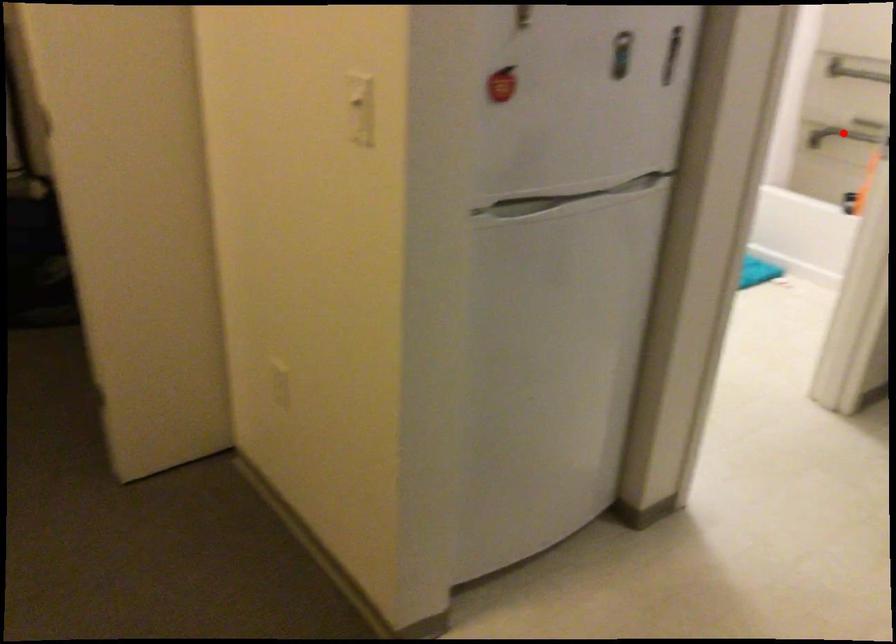
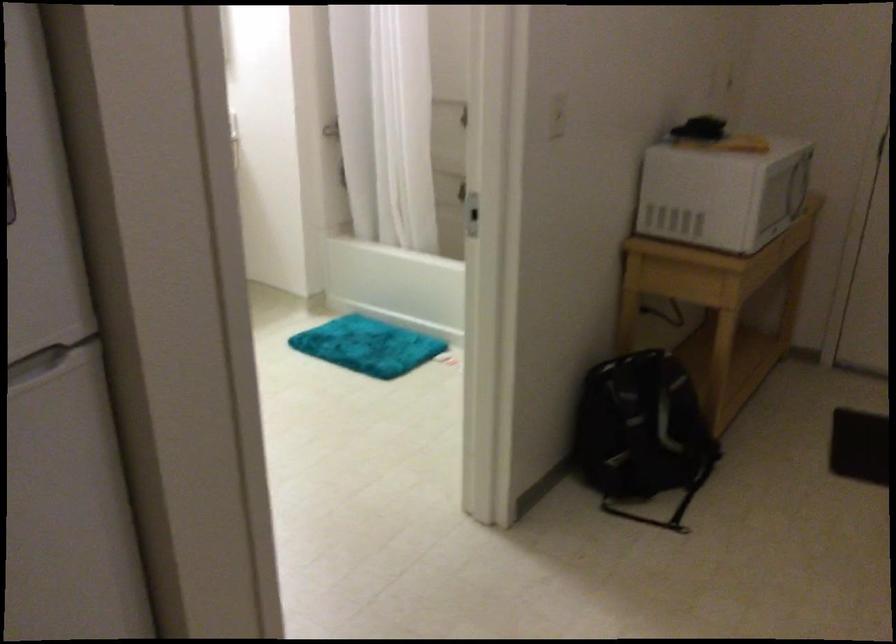
Question: I am providing you with two images of the same scene from different viewpoints. A red point is marked on the first image. Is the red point's position out of view in image 2?

Choices:
 (A) Yes
 (B) No

Answer: (A)